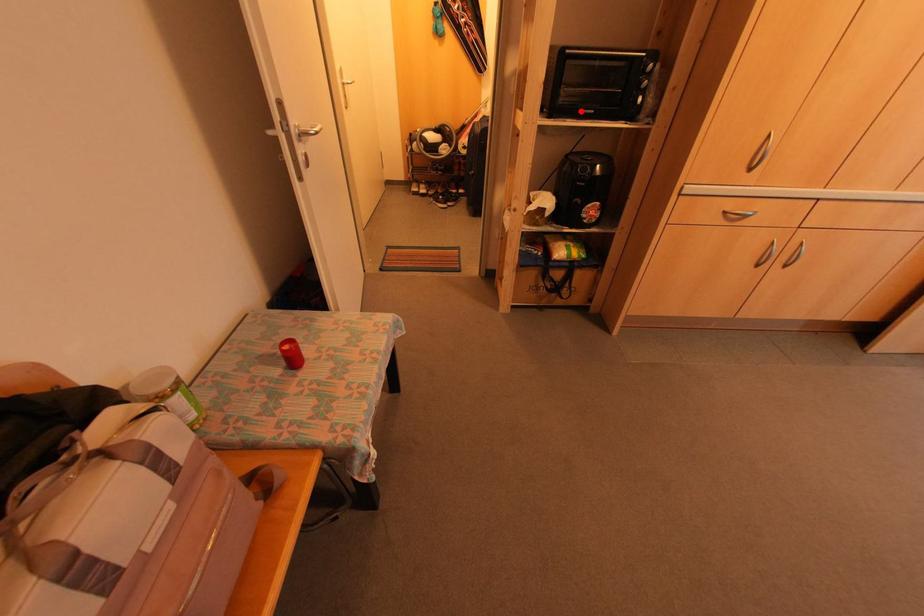
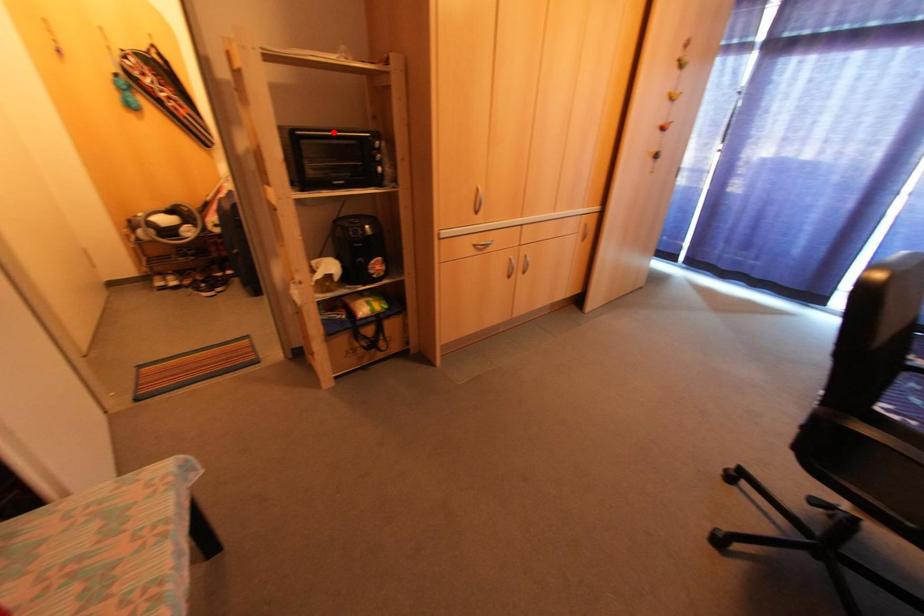
I am providing you with two images of the same scene from different viewpoints. A red point is marked on the first image and another point is marked on the second image. Are the points marked in image1 and image2 representing the same 3D position?

No